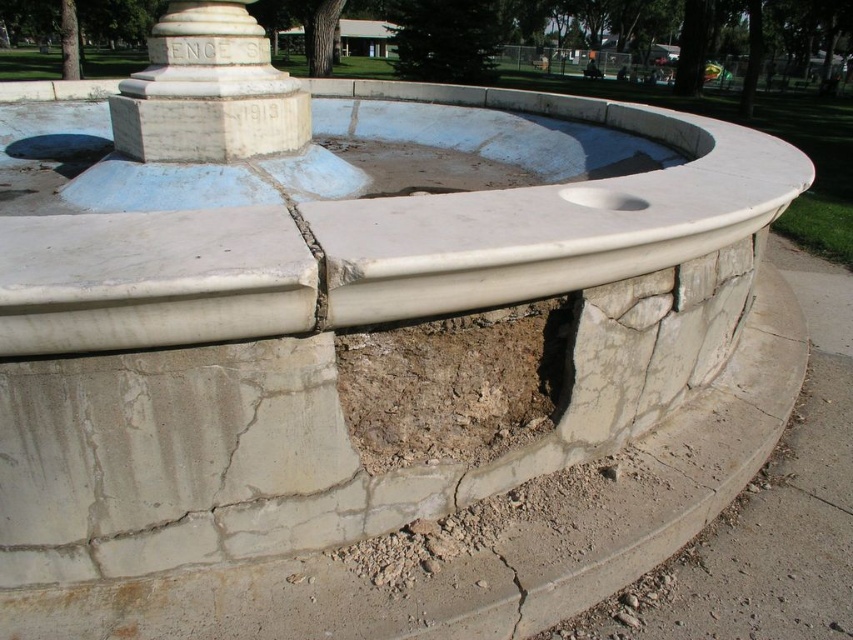
You are a maintenance worker who needs to repair the fountain. You have a repair tool that is 1 meter long. Can you reach from the cracked concrete at lower center to the smooth concrete hole at center with your tool?

The cracked concrete at lower center and smooth concrete hole at center are 1.01 meters apart from each other. Since the tool is only 1 meter long, it is 1 centimeter too short to reach between them.

You are a construction worker assessing the damage to the fountain. You notice the white stone column at center and the cracked concrete at lower center. Which object is positioned to the left side of the other?

The white stone column at center is to the left of cracked concrete at lower center.